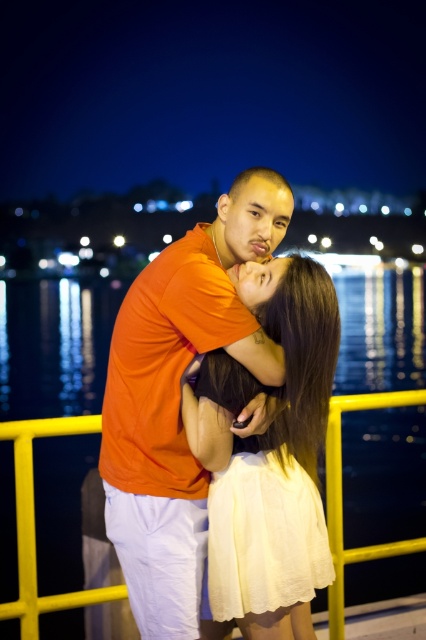
Question: Does matte white dress at center appear on the left side of yellow metal railing at lower center?

Choices:
 (A) yes
 (B) no

Answer: (A)

Question: Which object appears closest to the camera in this image?

Choices:
 (A) orange matte shirt at center
 (B) yellow metal railing at lower center
 (C) matte white dress at center

Answer: (C)

Question: Which of the following is the farthest from the observer?

Choices:
 (A) (193, 460)
 (B) (313, 264)

Answer: (A)

Question: Does orange matte shirt at center lie behind yellow metal railing at lower center?

Choices:
 (A) no
 (B) yes

Answer: (A)

Question: Does matte white dress at center have a greater width compared to yellow metal railing at lower center?

Choices:
 (A) no
 (B) yes

Answer: (A)

Question: Based on their relative distances, which object is farther from the yellow metal railing at lower center?

Choices:
 (A) orange matte shirt at center
 (B) matte white dress at center

Answer: (A)